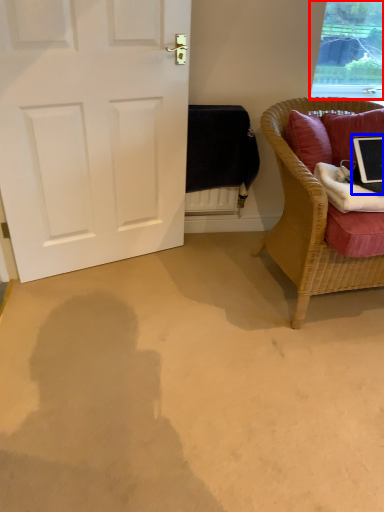
Question: Which object appears closest to the camera in this image, window (highlighted by a red box) or laptop (highlighted by a blue box)?

Choices:
 (A) window
 (B) laptop

Answer: (B)